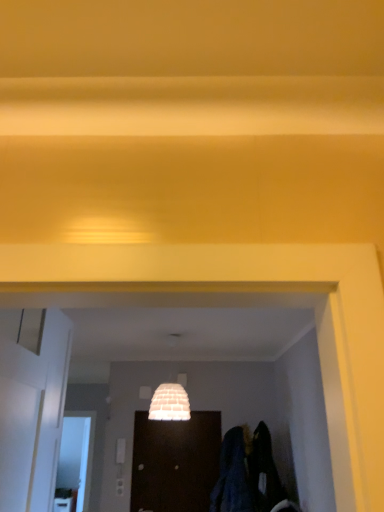
Question: Considering the positions of dark blue fabric at lower right and white glossy door at left, the second door when ordered from right to left, in the image, is dark blue fabric at lower right taller or shorter than white glossy door at left, the second door when ordered from right to left,?

Choices:
 (A) tall
 (B) short

Answer: (B)

Question: From the image's perspective, is dark blue fabric at lower right positioned above or below white glossy door at left, acting as the 2th door starting from the bottom?

Choices:
 (A) below
 (B) above

Answer: (A)

Question: Which is nearer to the white glossy door at left, which ranks as the second door in back-to-front order?

Choices:
 (A) white textured lampshade at center
 (B) dark blue fabric at lower right
 (C) dark wood door at center, the 2th door in the top-to-bottom sequence

Answer: (A)

Question: Which object is the closest to the white textured lampshade at center?

Choices:
 (A) dark blue fabric at lower right
 (B) dark wood door at center, the 2th door in the top-to-bottom sequence
 (C) white glossy door at left, the 1th door when ordered from front to back

Answer: (A)